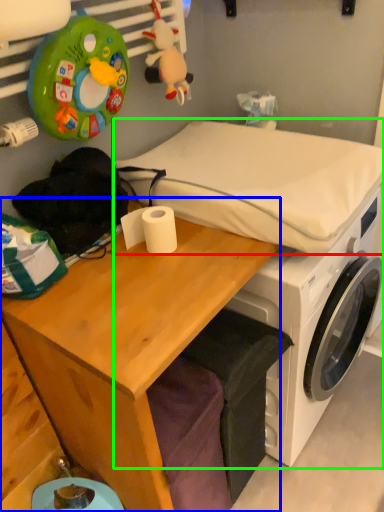
Question: Which is farther away from mattress (highlighted by a red box)? desk (highlighted by a blue box) or machine (highlighted by a green box)?

Choices:
 (A) desk
 (B) machine

Answer: (A)